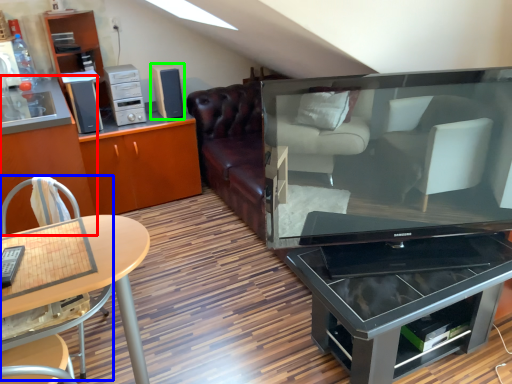
Question: Which is nearer to the cabinetry (highlighted by a red box)? chair (highlighted by a blue box) or speaker (highlighted by a green box).

Choices:
 (A) chair
 (B) speaker

Answer: (A)